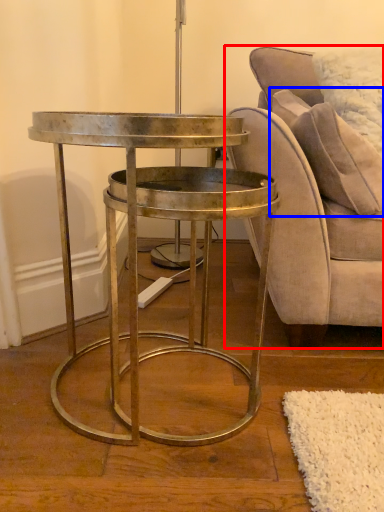
Question: Which object appears farthest to the camera in this image, chair (highlighted by a red box) or pillow (highlighted by a blue box)?

Choices:
 (A) chair
 (B) pillow

Answer: (B)